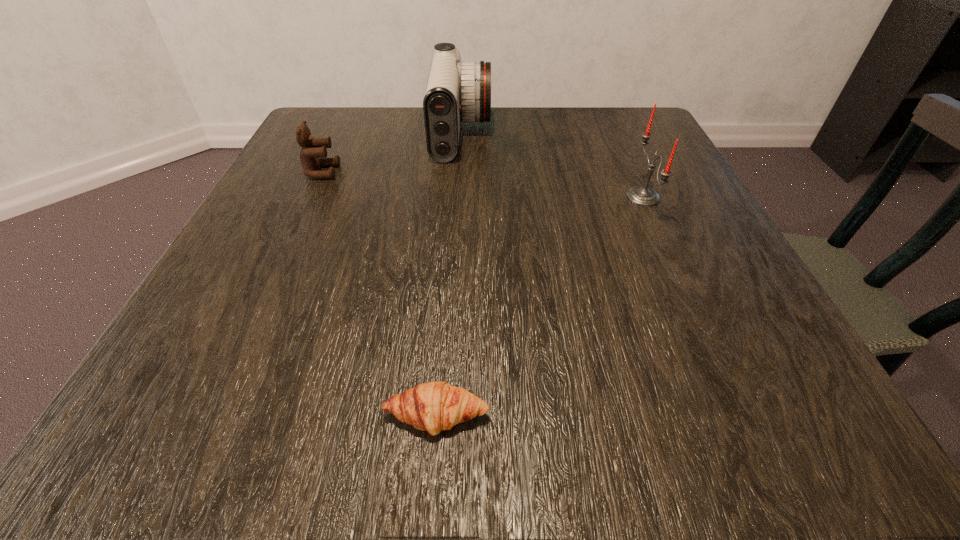
Locate an element on the screen. The height and width of the screenshot is (540, 960). camcorder is located at coordinates (456, 91).

The height and width of the screenshot is (540, 960). Identify the location of the rightmost object. (643, 196).

Locate an element on the screen. the leftmost object is located at coordinates (313, 153).

Where is `teddy bear`? This screenshot has height=540, width=960. teddy bear is located at coordinates (313, 153).

In order to click on the shortest object in this screenshot , I will do `click(434, 406)`.

Identify the location of pastry. This screenshot has height=540, width=960. (434, 406).

The height and width of the screenshot is (540, 960). Identify the location of free space located on the surface of the camcorder. (514, 135).

Identify the location of free space located on the front-facing side of the rightmost object. (592, 197).

You are a GUI agent. You are given a task and a screenshot of the screen. Output one action in this format:
    pyautogui.click(x=<x>, y=<y>)
    Task: Click on the vacant space situated 0.090m on the front-facing side of the rightmost object
    Image resolution: width=960 pixels, height=540 pixels.
    Given the screenshot: What is the action you would take?
    pyautogui.click(x=575, y=197)

Where is `free location located on the front-facing side of the rightmost object`? The image size is (960, 540). free location located on the front-facing side of the rightmost object is located at coordinates (569, 197).